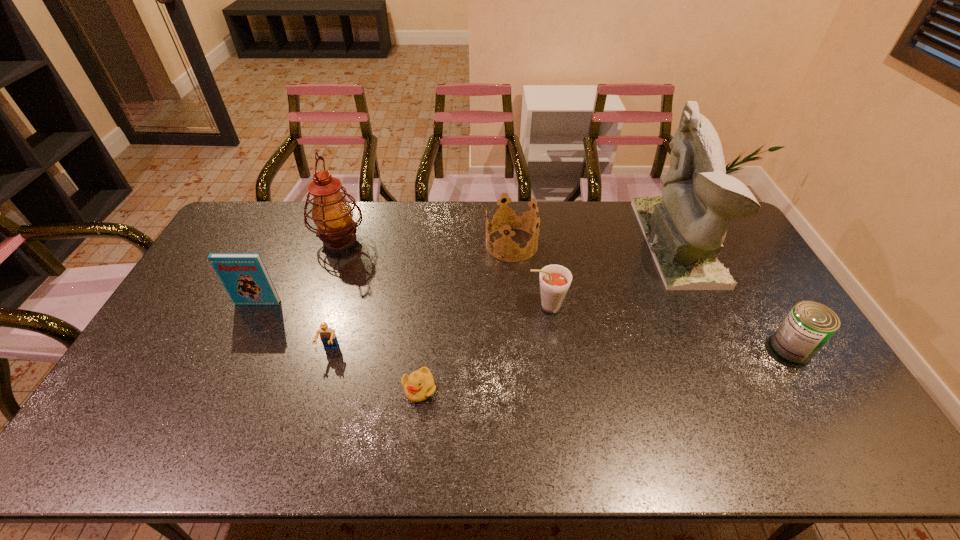
Where is `vacant space located on the face of the second shortest object`? Image resolution: width=960 pixels, height=540 pixels. vacant space located on the face of the second shortest object is located at coordinates (299, 458).

Find the location of `vacant area situated on the front-facing side of the fourth object from left to right`. vacant area situated on the front-facing side of the fourth object from left to right is located at coordinates (415, 430).

Where is `sculpture that is positioned at the far edge`? This screenshot has width=960, height=540. sculpture that is positioned at the far edge is located at coordinates (685, 227).

At what (x,y) coordinates should I click in order to perform the action: click on oil lamp that is at the far edge. Please return your answer as a coordinate pair (x, y). Image resolution: width=960 pixels, height=540 pixels. Looking at the image, I should click on (331, 212).

Where is `crown that is at the far edge`? This screenshot has height=540, width=960. crown that is at the far edge is located at coordinates (513, 219).

Identify the location of sculpture that is at the right edge. point(685,227).

Locate an element on the screen. The width and height of the screenshot is (960, 540). can located in the right edge section of the desktop is located at coordinates (809, 325).

You are a GUI agent. You are given a task and a screenshot of the screen. Output one action in this format:
    pyautogui.click(x=<x>, y=<y>)
    Task: Click on the object present at the far right corner
    The image size is (960, 540).
    Given the screenshot: What is the action you would take?
    pyautogui.click(x=685, y=227)

In the image, there is a desktop. Where is `vacant space at the far edge`? vacant space at the far edge is located at coordinates (373, 206).

The width and height of the screenshot is (960, 540). In order to click on blank area at the near edge in this screenshot , I will do `click(220, 427)`.